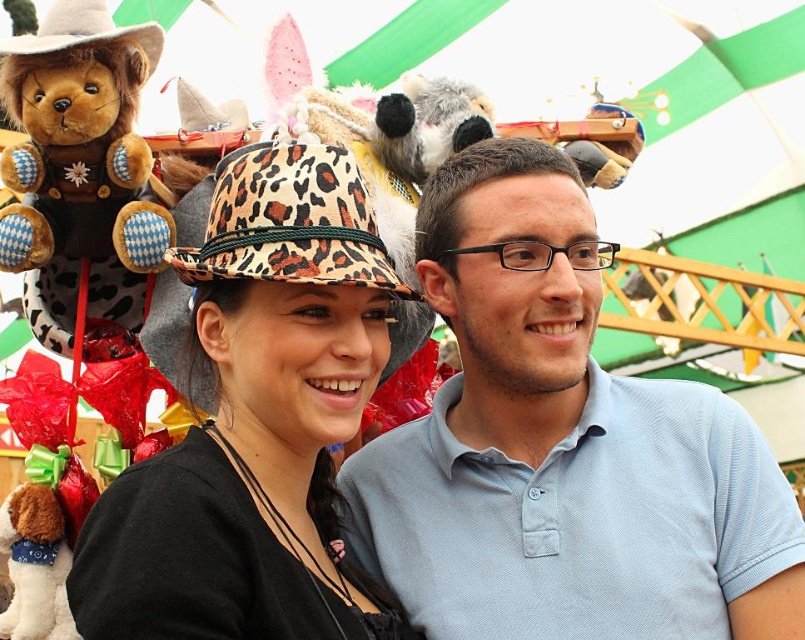
You are a photographer trying to capture a photo of both the light blue cotton shirt at center and the leopard print fabric bucket hat at center. Since you want to ensure both are in the frame, which object should you position your camera closer to?

You should position your camera closer to the leopard print fabric bucket hat at center because the light blue cotton shirt at center is to the right of it, so centering the camera between them would require focusing on the hat first to include both in the frame.

You are at a gift shop and see the light blue cotton shirt at center and the brown plush bear at left. Which item is closer to the right side of the shelf?

The light blue cotton shirt at center is positioned on the right side of the brown plush bear at left, so the light blue cotton shirt at center is closer to the right side of the shelf.

You are a photographer trying to focus on the light blue cotton shirt at center. What are the exact coordinates where you should aim your camera lens?

The light blue cotton shirt at center is located at the 2D coordinates point (x=562, y=449).